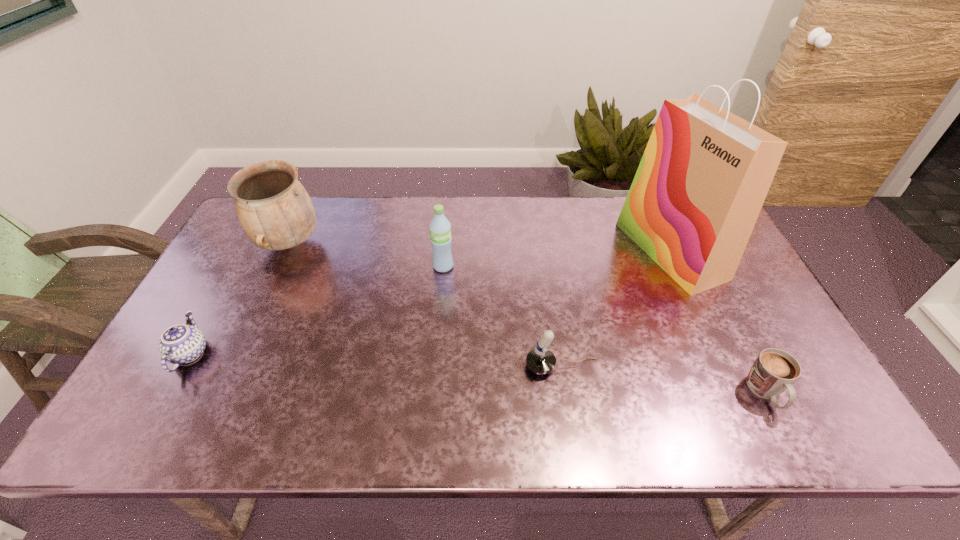
Image resolution: width=960 pixels, height=540 pixels. In order to click on object located in the far left corner section of the desktop in this screenshot , I will do `click(274, 209)`.

Where is `object located at the far right corner`? This screenshot has height=540, width=960. object located at the far right corner is located at coordinates (705, 173).

Identify the location of object that is at the near right corner. The height and width of the screenshot is (540, 960). (774, 371).

The width and height of the screenshot is (960, 540). In the image, there is a desktop. Find the location of `free space at the far edge`. free space at the far edge is located at coordinates (540, 212).

In the image, there is a desktop. Where is `free space at the near edge`? free space at the near edge is located at coordinates (313, 441).

I want to click on vacant area at the left edge, so click(x=230, y=306).

At what (x,y) coordinates should I click in order to perform the action: click on free location at the near left corner. Please return your answer as a coordinate pair (x, y). This screenshot has width=960, height=540. Looking at the image, I should click on (118, 437).

Image resolution: width=960 pixels, height=540 pixels. I want to click on vacant point located between the chinaware and the mug, so click(478, 373).

The image size is (960, 540). In order to click on vacant space in between the urn and the shopping bag in this screenshot , I will do `click(480, 247)`.

The width and height of the screenshot is (960, 540). In order to click on free spot between the third object from left to right and the chinaware in this screenshot , I will do `click(317, 310)`.